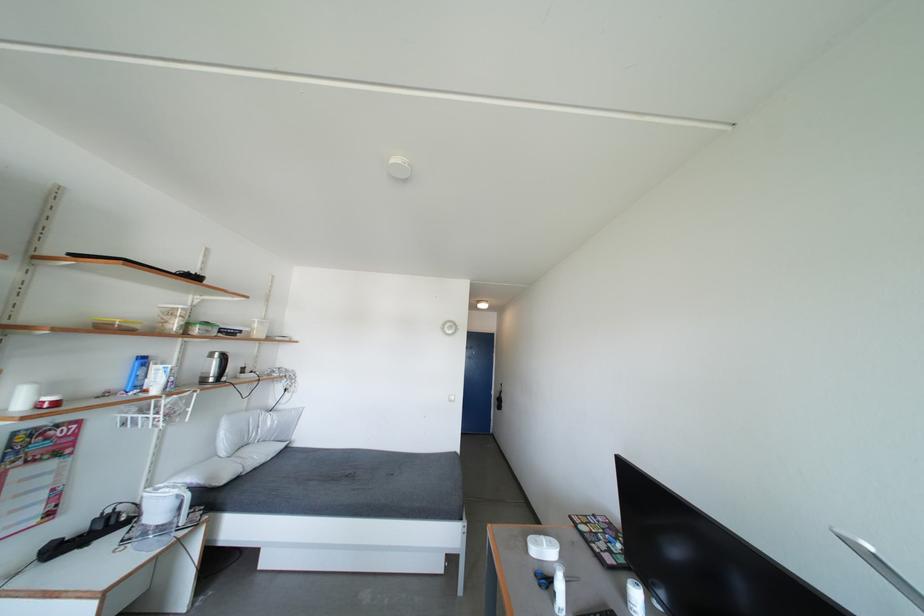
Locate an element on the screen. The height and width of the screenshot is (616, 924). white cup is located at coordinates (542, 546).